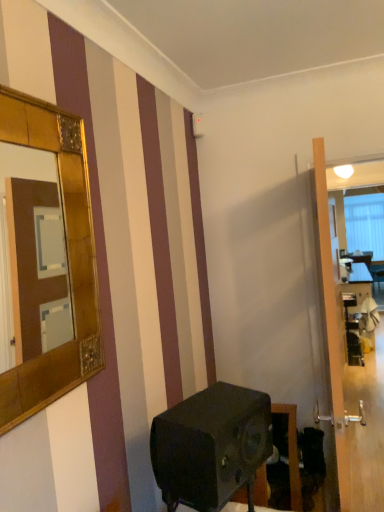
Question: Can you confirm if matte black speaker at lower center is positioned to the left of transparent glass door at right?

Choices:
 (A) no
 (B) yes

Answer: (B)

Question: Does matte black speaker at lower center appear on the right side of transparent glass door at right?

Choices:
 (A) no
 (B) yes

Answer: (A)

Question: From a real-world perspective, does matte black speaker at lower center stand above transparent glass door at right?

Choices:
 (A) yes
 (B) no

Answer: (B)

Question: Are matte black speaker at lower center and transparent glass door at right making contact?

Choices:
 (A) yes
 (B) no

Answer: (B)

Question: Could transparent glass door at right be considered to be inside matte black speaker at lower center?

Choices:
 (A) no
 (B) yes

Answer: (A)

Question: Which is correct: gold textured mirror at upper left is inside matte black speaker at lower center, or outside of it?

Choices:
 (A) inside
 (B) outside

Answer: (B)

Question: From the image's perspective, is gold textured mirror at upper left located above or below matte black speaker at lower center?

Choices:
 (A) above
 (B) below

Answer: (A)

Question: Based on their sizes in the image, would you say gold textured mirror at upper left is bigger or smaller than matte black speaker at lower center?

Choices:
 (A) small
 (B) big

Answer: (A)

Question: Is gold textured mirror at upper left to the left or to the right of matte black speaker at lower center in the image?

Choices:
 (A) right
 (B) left

Answer: (B)

Question: Is matte black speaker at lower center taller or shorter than gold textured mirror at upper left?

Choices:
 (A) short
 (B) tall

Answer: (A)

Question: Does point (225, 400) appear closer or farther from the camera than point (66, 227)?

Choices:
 (A) farther
 (B) closer

Answer: (A)

Question: From the image's perspective, is matte black speaker at lower center above or below gold textured mirror at upper left?

Choices:
 (A) above
 (B) below

Answer: (B)

Question: Would you say matte black speaker at lower center is inside or outside gold textured mirror at upper left?

Choices:
 (A) inside
 (B) outside

Answer: (B)

Question: Choose the correct answer: Is transparent glass door at right inside matte black speaker at lower center or outside it?

Choices:
 (A) inside
 (B) outside

Answer: (B)

Question: Does point (365, 505) appear closer or farther from the camera than point (198, 498)?

Choices:
 (A) farther
 (B) closer

Answer: (A)